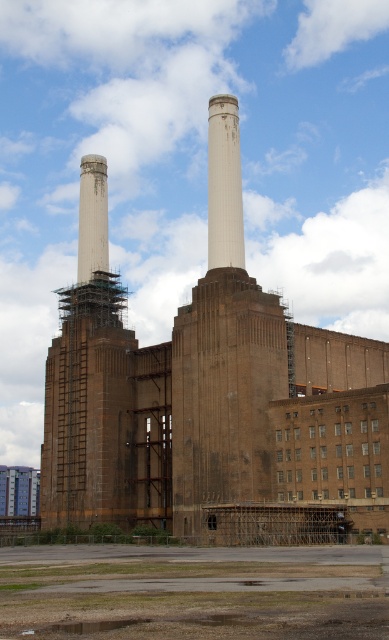
Question: Observing the image, what is the correct spatial positioning of brown brick factory at center in reference to green leafy plant at lower center?

Choices:
 (A) left
 (B) right

Answer: (B)

Question: Can you confirm if brown brick factory at center is positioned below brown brick chimney at left?

Choices:
 (A) no
 (B) yes

Answer: (B)

Question: Is brown brick factory at center in front of brown brick chimney at left?

Choices:
 (A) yes
 (B) no

Answer: (A)

Question: Which object is closer to the camera taking this photo?

Choices:
 (A) brown brick chimney at left
 (B) green leafy plant at lower center
 (C) white concrete chimney at center

Answer: (B)

Question: Which object is the closest to the brown brick chimney at left?

Choices:
 (A) brown brick factory at center
 (B) white concrete chimney at center
 (C) green leafy plant at lower center

Answer: (A)

Question: Which object is positioned farthest from the white concrete chimney at center?

Choices:
 (A) brown brick chimney at left
 (B) brown brick factory at center

Answer: (A)